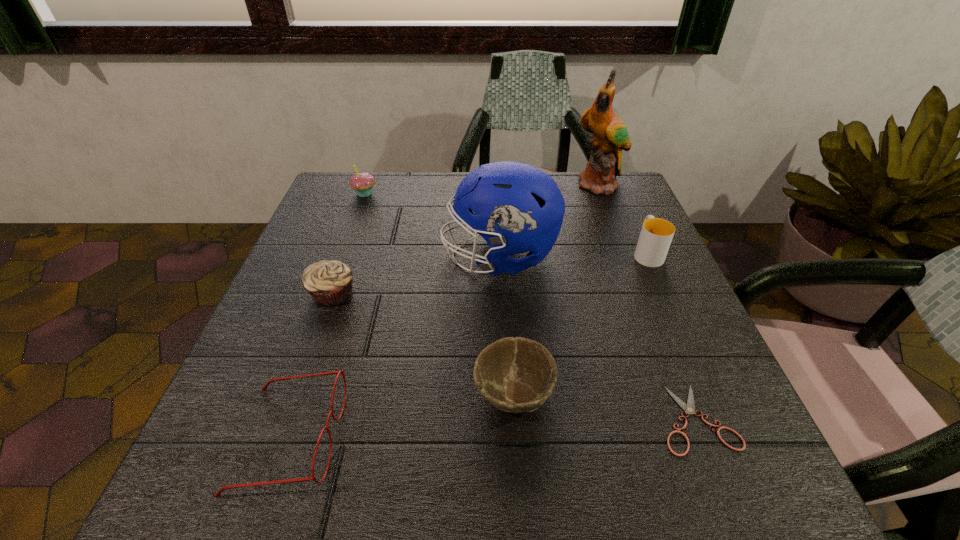
Identify the location of parrot. (610, 136).

Where is `football helmet`? This screenshot has height=540, width=960. football helmet is located at coordinates (515, 207).

At what (x,y) coordinates should I click in order to perform the action: click on cupcake. Please return your answer as a coordinate pair (x, y). Looking at the image, I should click on (363, 182).

This screenshot has width=960, height=540. Find the location of `cup`. cup is located at coordinates (656, 234).

The width and height of the screenshot is (960, 540). Find the location of `muffin`. muffin is located at coordinates (330, 283).

Where is `bowl`? The width and height of the screenshot is (960, 540). bowl is located at coordinates (516, 375).

At what (x,y) coordinates should I click in order to perform the action: click on spectacles. Please return your answer as a coordinate pair (x, y). The image size is (960, 540). Looking at the image, I should click on (264, 388).

Image resolution: width=960 pixels, height=540 pixels. I want to click on shears, so click(x=689, y=408).

Where is `vacant area located on the front-facing side of the tallest object`? The width and height of the screenshot is (960, 540). vacant area located on the front-facing side of the tallest object is located at coordinates (620, 238).

Locate an element on the screen. The height and width of the screenshot is (540, 960). vacant space situated on the front-facing side of the seventh shortest object is located at coordinates (420, 256).